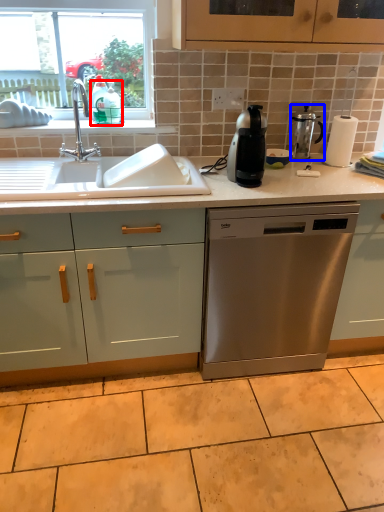
Question: Among these objects, which one is farthest to the camera, teal (highlighted by a red box) or kitchen appliance (highlighted by a blue box)?

Choices:
 (A) teal
 (B) kitchen appliance

Answer: (B)